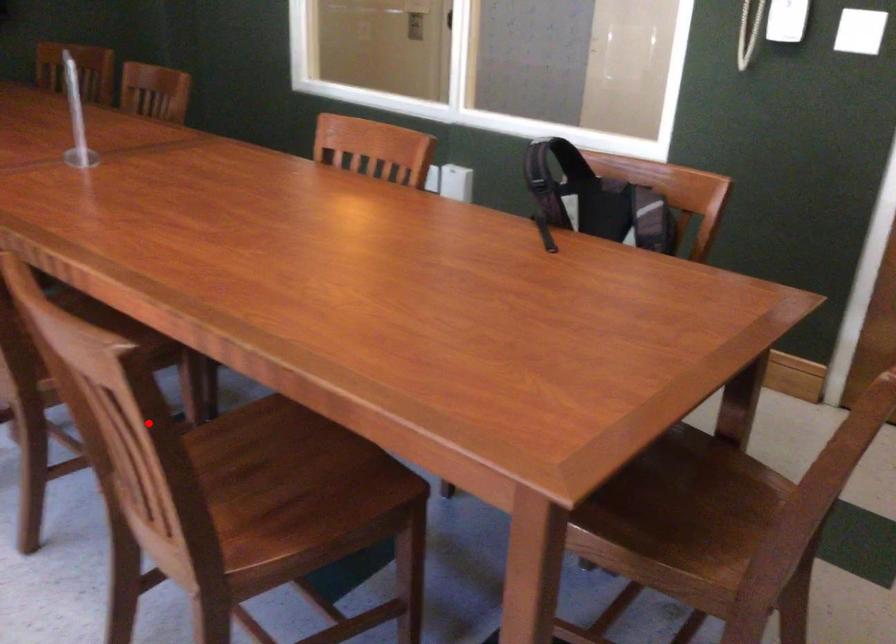
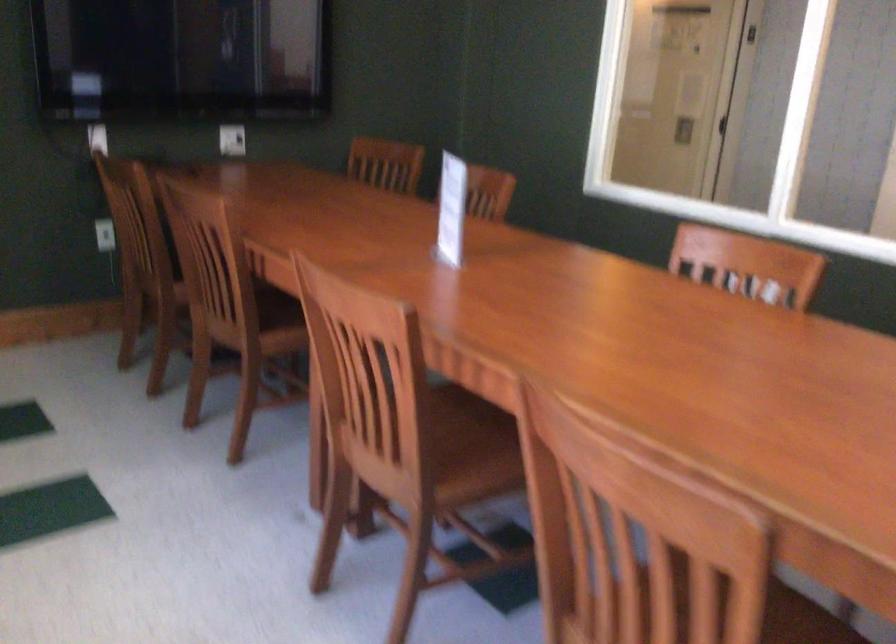
In the second image, find the point that corresponds to the highlighted location in the first image.

(709, 588)